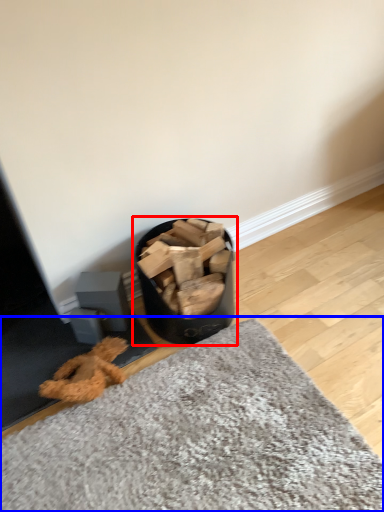
Question: Which object appears farthest to the camera in this image, waste container (highlighted by a red box) or mat (highlighted by a blue box)?

Choices:
 (A) waste container
 (B) mat

Answer: (A)